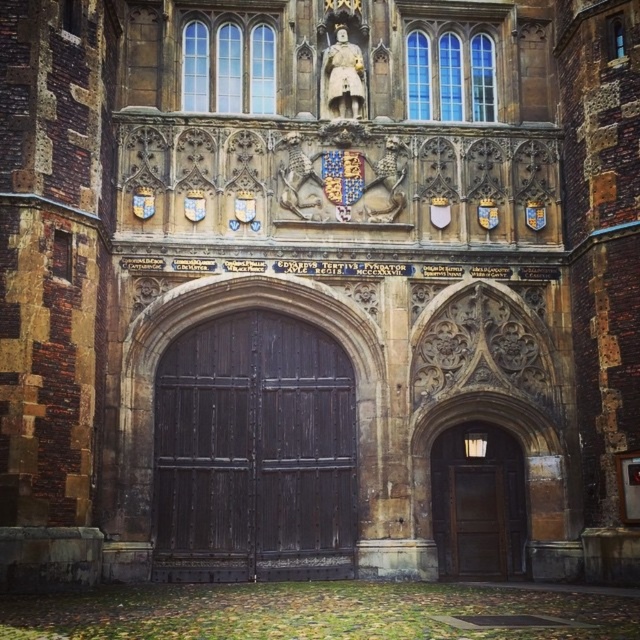
You are a visitor approaching the historic building and want to enter through the main entrance. Which door should you use, the dark wood door at center or the brown wooden door at center?

The dark wood door at center is to the left of the brown wooden door at center, so the dark wood door at center is the main entrance.

You are standing in front of the historic building entrance and notice two points marked on the facade. The first point is at coordinate point (342, 490) and the second at point (460, 435). Which point is closer to you?

Point (342, 490) is closer to the viewer than point (460, 435).